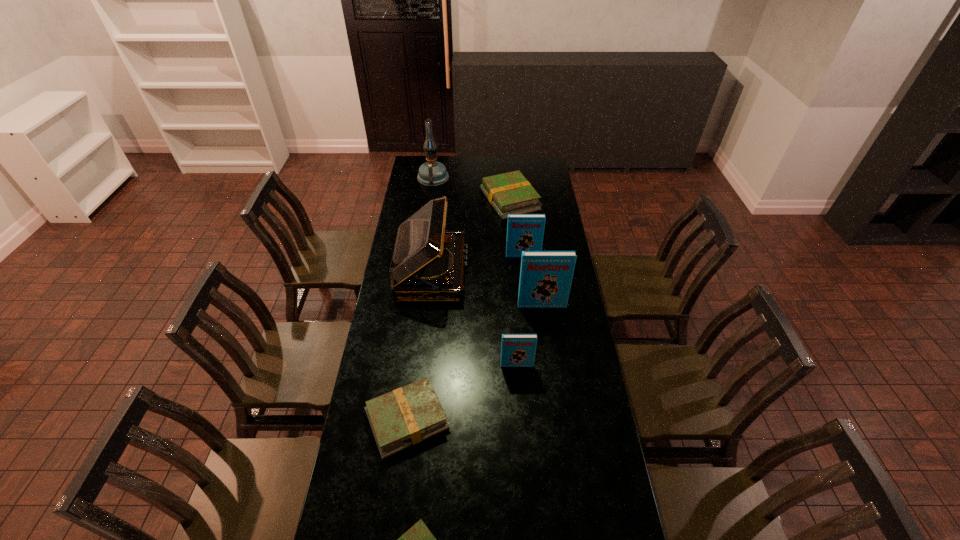
Image resolution: width=960 pixels, height=540 pixels. I want to click on book that is the second closest to the record player, so click(x=509, y=193).

This screenshot has width=960, height=540. I want to click on the third closest book relative to the second smallest yellow book, so click(545, 276).

Locate an element on the screen. Image resolution: width=960 pixels, height=540 pixels. blue book that is the second closest to the smallest blue book is located at coordinates (525, 232).

I want to click on blue book that can be found as the second closest to the farthest book, so click(x=545, y=276).

Point out which yellow book is positioned as the third nearest to the record player. Please provide its 2D coordinates. Your answer should be formatted as a tuple, i.e. [(x, y)], where the tuple contains the x and y coordinates of a point satisfying the conditions above.

[(418, 539)]

Find the location of `the closest yellow book to the nearest book`. the closest yellow book to the nearest book is located at coordinates (408, 415).